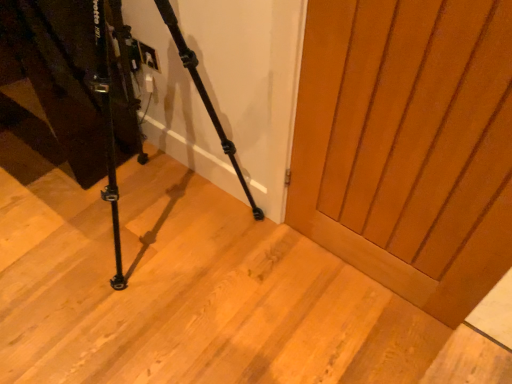
The width and height of the screenshot is (512, 384). Identify the location of free space in front of black matte tripod at lower left. click(140, 338).